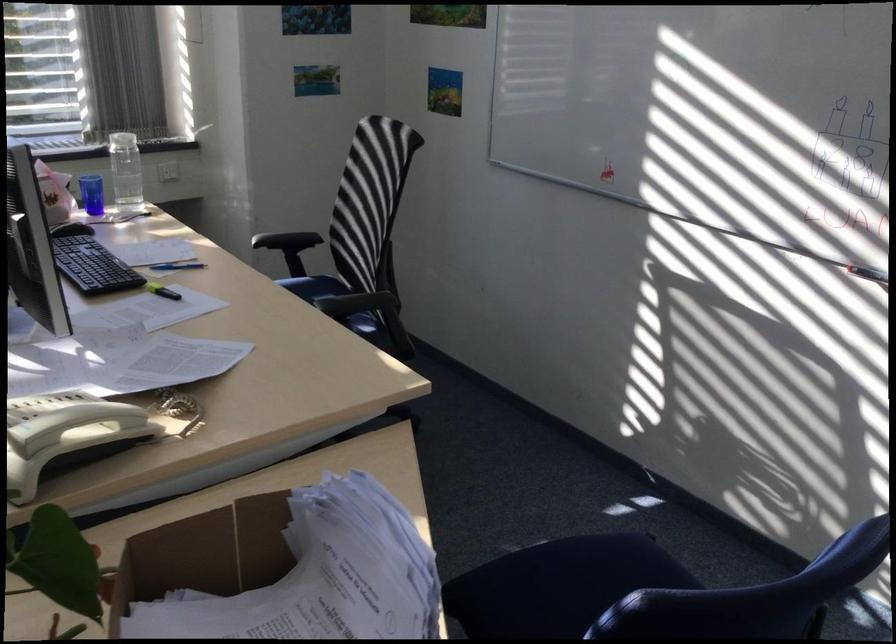
Where is `glass water pitcher`? This screenshot has width=896, height=644. glass water pitcher is located at coordinates (125, 172).